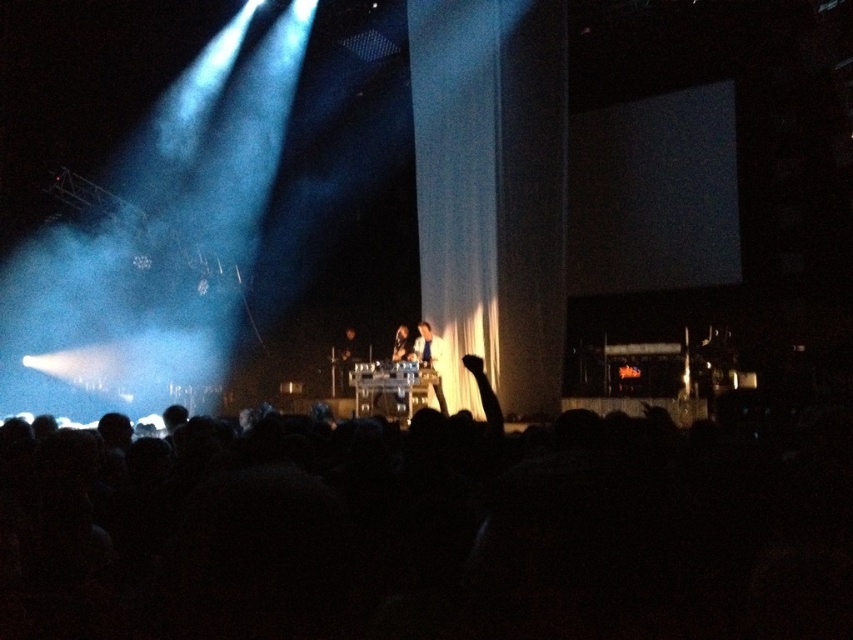
Question: Which of the following is the farthest from the observer?

Choices:
 (A) (6, 456)
 (B) (416, 360)

Answer: (B)

Question: Which of these objects is positioned farthest from the shiny black jacket at center?

Choices:
 (A) shiny black microphone at center
 (B) black matte crowd at lower center

Answer: (B)

Question: From the image, what is the correct spatial relationship of black matte crowd at lower center in relation to shiny black microphone at center?

Choices:
 (A) right
 (B) left

Answer: (A)

Question: Is black matte crowd at lower center closer to camera compared to shiny black jacket at center?

Choices:
 (A) yes
 (B) no

Answer: (A)

Question: Which object is the closest to the shiny black microphone at center?

Choices:
 (A) black matte crowd at lower center
 (B) shiny black jacket at center

Answer: (B)

Question: Is black matte crowd at lower center to the right of shiny black microphone at center from the viewer's perspective?

Choices:
 (A) no
 (B) yes

Answer: (B)